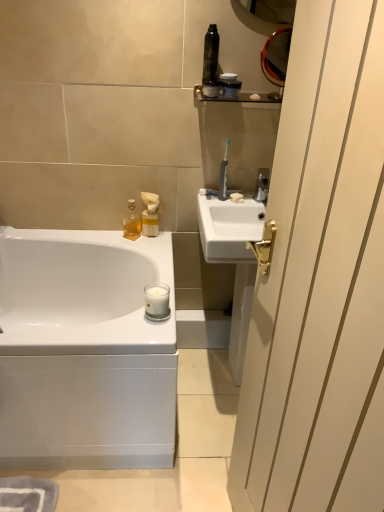
At what (x,y) coordinates should I click in order to perform the action: click on vacant space to the left of translucent glass bottle at upper left, which appears as the 1th toiletry when ordered from the bottom. Please return your answer as a coordinate pair (x, y). This screenshot has width=384, height=512. Looking at the image, I should click on (104, 236).